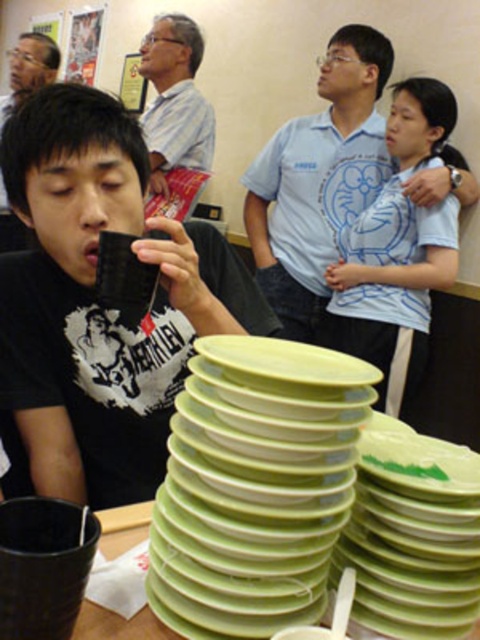
Between matte black mug at left and light blue printed shirt at upper center, which one has less height?

Standing shorter between the two is matte black mug at left.

Can you confirm if matte black mug at left is positioned to the right of light blue printed shirt at upper center?

In fact, matte black mug at left is to the left of light blue printed shirt at upper center.

The width and height of the screenshot is (480, 640). What are the coordinates of `matte black mug at left` in the screenshot? It's located at (99, 307).

Find the location of a particular element. This screenshot has width=480, height=640. matte black mug at left is located at coordinates (99, 307).

In the scene shown: Can you confirm if black matte cup at lower left is wider than matte black shirt at left?

In fact, black matte cup at lower left might be narrower than matte black shirt at left.

Is point (37, 564) positioned before point (16, 48)?

Yes, it is.

Find the location of a particular element. The height and width of the screenshot is (640, 480). black matte cup at lower left is located at coordinates (43, 566).

Who is higher up, green plastic plates at center or green plastic plates at lower center?

green plastic plates at center is above.

Is green plastic plates at center below green plastic plates at lower center?

No.

Is point (351, 472) closer to camera compared to point (139, 529)?

Yes, it is in front of point (139, 529).

Identify the location of green plastic plates at center. tap(254, 484).